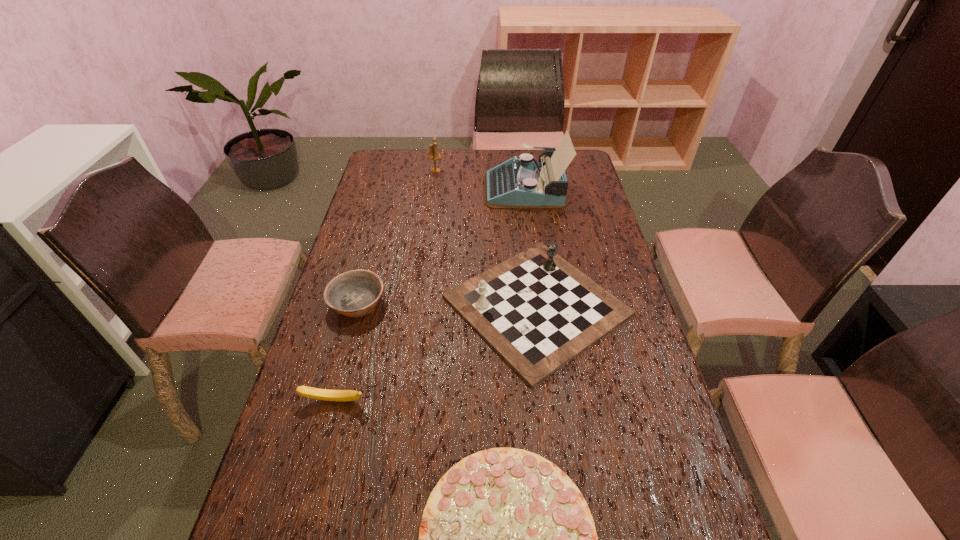
The height and width of the screenshot is (540, 960). I want to click on vacant space located 0.350m on the back of the fourth shortest object, so click(522, 188).

This screenshot has width=960, height=540. I want to click on free region located at the stem of the fifth farthest object, so click(327, 427).

Where is `vacant space located 0.320m on the front of the bowl`? vacant space located 0.320m on the front of the bowl is located at coordinates (323, 431).

You are a GUI agent. You are given a task and a screenshot of the screen. Output one action in this format:
    pyautogui.click(x=<x>, y=<y>)
    Task: Click on the typewriter that is at the far edge
    The image size is (960, 540).
    Given the screenshot: What is the action you would take?
    pyautogui.click(x=523, y=183)

Locate an element on the screen. candle holder at the far edge is located at coordinates (433, 154).

Locate an element on the screen. The image size is (960, 540). banana that is at the left edge is located at coordinates (315, 393).

This screenshot has height=540, width=960. Find the location of `bowl that is positioned at the left edge`. bowl that is positioned at the left edge is located at coordinates pyautogui.click(x=356, y=293).

I want to click on typewriter that is at the right edge, so click(x=523, y=183).

The image size is (960, 540). I want to click on gameboard present at the right edge, so [538, 312].

Locate an element on the screen. The width and height of the screenshot is (960, 540). object that is at the far right corner is located at coordinates (523, 183).